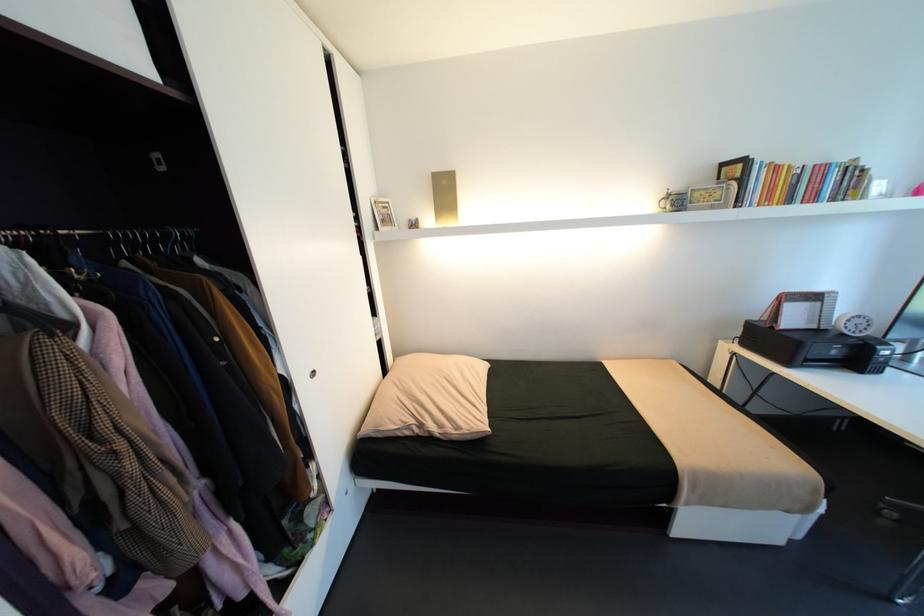
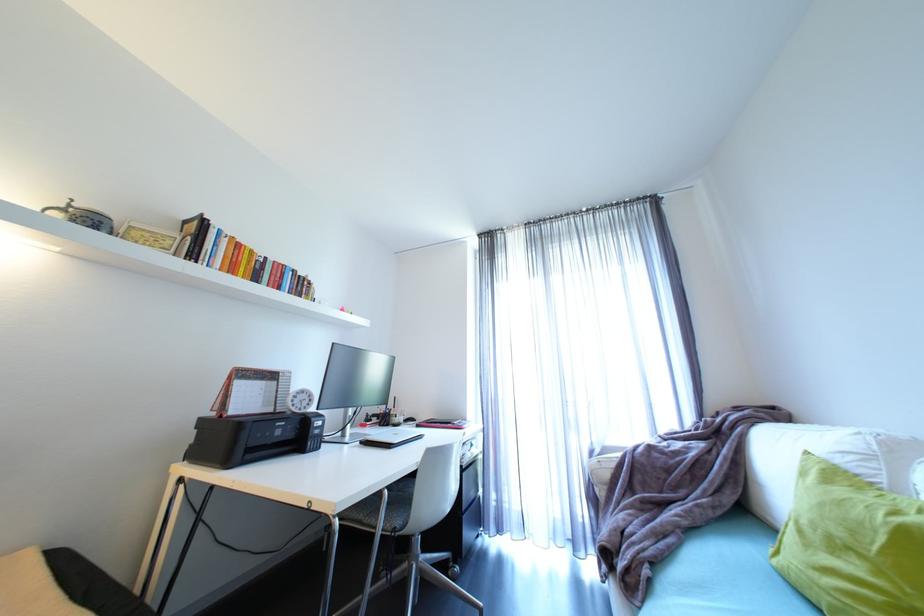
Locate, in the second image, the point that corresponds to point (752, 203) in the first image.

(208, 262)